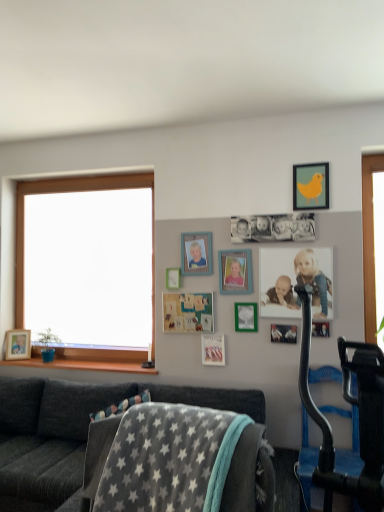
Question: Is teal matte corkboard at center, positioned as the 8th picture frame in front-to-back order, behind velvet dark gray couch at lower left?

Choices:
 (A) no
 (B) yes

Answer: (B)

Question: Can we say teal matte corkboard at center, which is the fourth picture frame in back-to-front order, lies outside velvet dark gray couch at lower left?

Choices:
 (A) yes
 (B) no

Answer: (A)

Question: From the image's perspective, is teal matte corkboard at center, which is the 9th picture frame in right-to-left order, on top of velvet dark gray couch at lower left?

Choices:
 (A) no
 (B) yes

Answer: (B)

Question: Does teal matte corkboard at center, which is the 9th picture frame in right-to-left order, turn towards velvet dark gray couch at lower left?

Choices:
 (A) yes
 (B) no

Answer: (B)

Question: Is teal matte corkboard at center, the third picture frame positioned from the left, at the right side of velvet dark gray couch at lower left?

Choices:
 (A) no
 (B) yes

Answer: (B)

Question: From a real-world perspective, is teal matte corkboard at center, positioned as the 8th picture frame in front-to-back order, beneath velvet dark gray couch at lower left?

Choices:
 (A) yes
 (B) no

Answer: (B)

Question: Could you tell me if velvet dark gray couch at lower left is turned towards green matte picture frame at upper center, the seventh picture frame when ordered from left to right?

Choices:
 (A) no
 (B) yes

Answer: (A)

Question: Is velvet dark gray couch at lower left oriented away from green matte picture frame at upper center, the seventh picture frame positioned from the back?

Choices:
 (A) yes
 (B) no

Answer: (B)

Question: Is velvet dark gray couch at lower left not within green matte picture frame at upper center, the 5th picture frame positioned from the front?

Choices:
 (A) no
 (B) yes

Answer: (B)

Question: Considering the relative sizes of velvet dark gray couch at lower left and green matte picture frame at upper center, the seventh picture frame positioned from the back, in the image provided, is velvet dark gray couch at lower left bigger than green matte picture frame at upper center, the seventh picture frame positioned from the back,?

Choices:
 (A) no
 (B) yes

Answer: (B)

Question: Is the position of velvet dark gray couch at lower left more distant than that of green matte picture frame at upper center, the seventh picture frame when ordered from left to right?

Choices:
 (A) no
 (B) yes

Answer: (A)

Question: Can you confirm if velvet dark gray couch at lower left is wider than green matte picture frame at upper center, the seventh picture frame when ordered from left to right?

Choices:
 (A) no
 (B) yes

Answer: (B)

Question: Is matte white picture frame at center, which is the 2th picture frame from back to front, oriented towards metallic silver photo frame at center, which ranks as the 8th picture frame in left-to-right order?

Choices:
 (A) yes
 (B) no

Answer: (B)